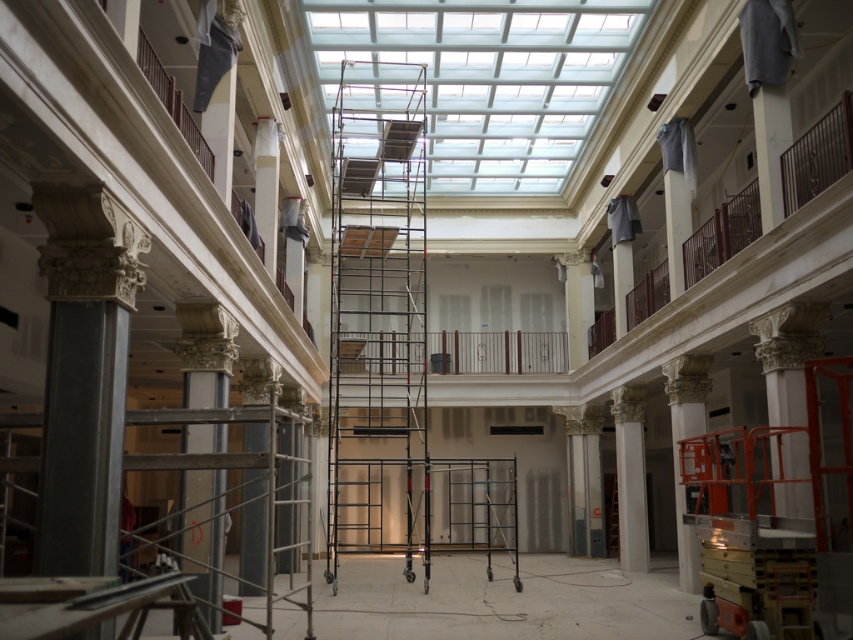
Question: Considering the real-world distances, which object is farthest from the white marble pillar at center?

Choices:
 (A) white marble column at lower left
 (B) white marble column at right

Answer: (A)

Question: Which point appears closest to the camera in this image?

Choices:
 (A) (202, 371)
 (B) (619, 422)
 (C) (416, 115)

Answer: (A)

Question: Can you confirm if black metal scaffolding at center is smaller than white marble column at right?

Choices:
 (A) no
 (B) yes

Answer: (A)

Question: Which point is farther to the camera?

Choices:
 (A) white marble pillar at center
 (B) black metal scaffolding at center
 (C) white marble column at lower left
 (D) white marble column at right

Answer: (A)

Question: Can you confirm if black metal scaffolding at center is positioned to the left of white marble pillar at center?

Choices:
 (A) no
 (B) yes

Answer: (B)

Question: Is white marble column at lower left further to the viewer compared to white marble column at right?

Choices:
 (A) no
 (B) yes

Answer: (A)